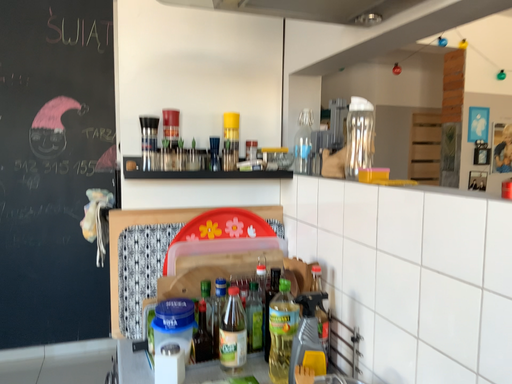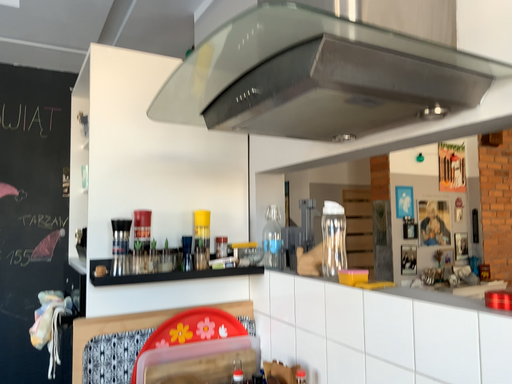
Question: How did the camera likely rotate when shooting the video?

Choices:
 (A) rotated upward
 (B) rotated downward

Answer: (A)